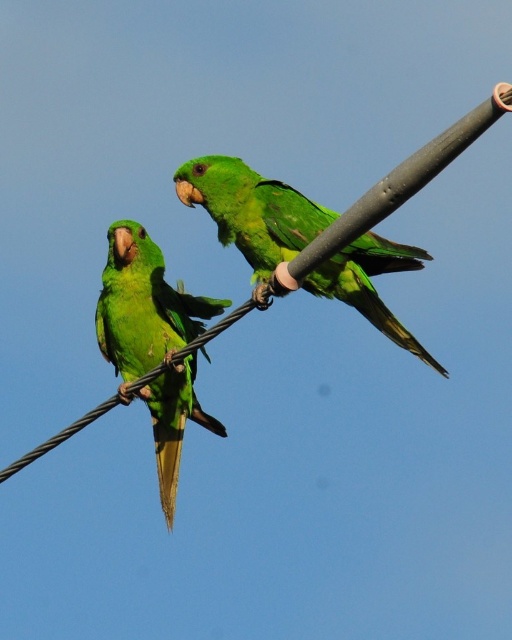
You are a bird trainer who needs to place a small treat between the two green matte parrots. Given that the treat requires 50 centimeters of space to be placed safely, will there be enough space between the green matte parrot at center and the green matte parrot at left?

The green matte parrot at center is 56.21 centimeters away from the green matte parrot at left, which is more than the required 50 centimeters. Therefore, there is sufficient space to place the treat safely between them.

Based on the photo, you are a birdwatcher observing two green matte parrots in the scene. Which parrot, the green matte parrot at center or the green matte parrot at left, is located to the right of the other?

The green matte parrot at center is positioned on the right side of green matte parrot at left.

You are a birdwatcher observing two green matte parrots in the image. Which parrot, the green matte parrot at center or the green matte parrot at left, is closer to you?

The green matte parrot at center is closer to you because it is in front of the green matte parrot at left.